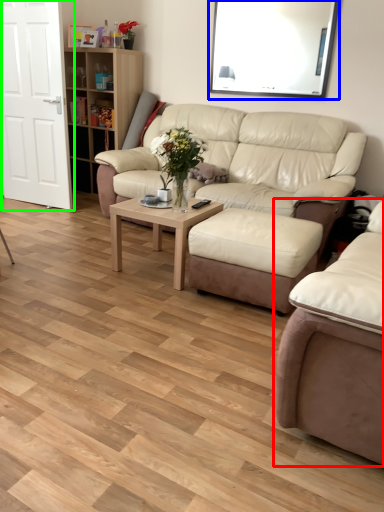
Question: Which is nearer to the studio couch (highlighted by a red box)? window screen (highlighted by a blue box) or door (highlighted by a green box).

Choices:
 (A) window screen
 (B) door

Answer: (B)